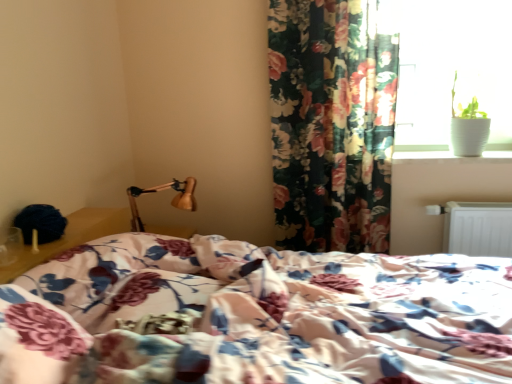
Question: Does white metallic radiator at lower right come behind white glossy window sill at upper right?

Choices:
 (A) yes
 (B) no

Answer: (B)

Question: Does white metallic radiator at lower right have a greater width compared to white glossy window sill at upper right?

Choices:
 (A) yes
 (B) no

Answer: (B)

Question: Does white metallic radiator at lower right have a lesser height compared to white glossy window sill at upper right?

Choices:
 (A) no
 (B) yes

Answer: (A)

Question: Considering the relative sizes of white metallic radiator at lower right and white glossy window sill at upper right in the image provided, is white metallic radiator at lower right taller than white glossy window sill at upper right?

Choices:
 (A) no
 (B) yes

Answer: (B)

Question: From the image's perspective, is white metallic radiator at lower right beneath white glossy window sill at upper right?

Choices:
 (A) yes
 (B) no

Answer: (A)

Question: Do you think floral fabric curtain at upper right is within white glossy window sill at upper right, or outside of it?

Choices:
 (A) outside
 (B) inside

Answer: (A)

Question: Is point (389, 34) closer or farther from the camera than point (394, 162)?

Choices:
 (A) closer
 (B) farther

Answer: (A)

Question: From the image's perspective, is floral fabric curtain at upper right above or below white glossy window sill at upper right?

Choices:
 (A) above
 (B) below

Answer: (A)

Question: Is floral fabric curtain at upper right to the left or to the right of white glossy window sill at upper right in the image?

Choices:
 (A) left
 (B) right

Answer: (A)

Question: In terms of height, does white glossy window sill at upper right look taller or shorter compared to wooden lamp at upper left?

Choices:
 (A) tall
 (B) short

Answer: (B)

Question: Considering the positions of white glossy window sill at upper right and wooden lamp at upper left in the image, is white glossy window sill at upper right wider or thinner than wooden lamp at upper left?

Choices:
 (A) thin
 (B) wide

Answer: (A)

Question: Is point (422, 152) closer or farther from the camera than point (190, 201)?

Choices:
 (A) closer
 (B) farther

Answer: (A)

Question: Do you think white glossy window sill at upper right is within wooden lamp at upper left, or outside of it?

Choices:
 (A) inside
 (B) outside

Answer: (B)

Question: From a real-world perspective, is wooden lamp at upper left positioned above or below floral fabric curtain at upper right?

Choices:
 (A) below
 (B) above

Answer: (A)

Question: Based on their sizes in the image, would you say wooden lamp at upper left is bigger or smaller than floral fabric curtain at upper right?

Choices:
 (A) small
 (B) big

Answer: (A)